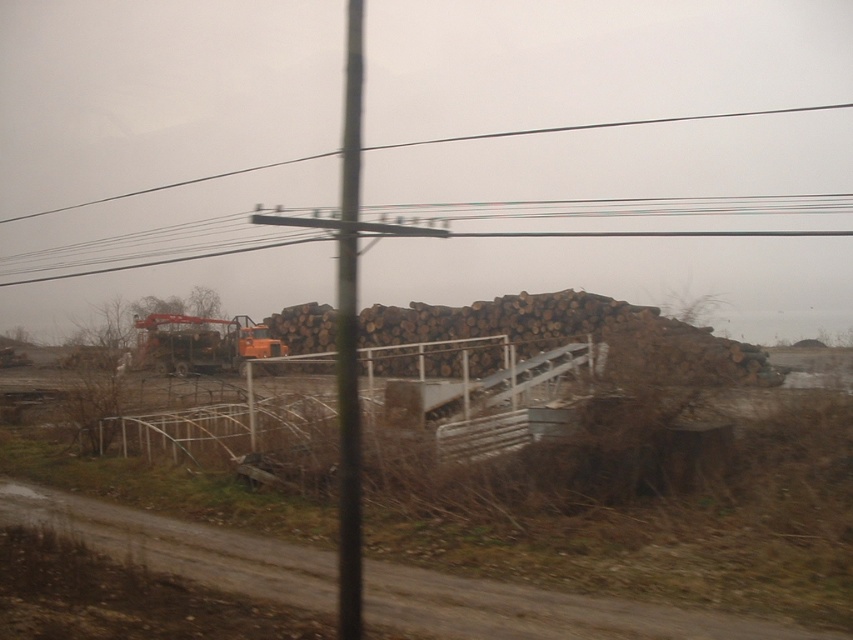
Looking at this image, measure the distance between metallic wire at upper center and camera.

metallic wire at upper center is 47.05 meters from camera.

Does metallic wire at upper center have a greater width compared to orange metallic excavator at center?

Indeed, metallic wire at upper center has a greater width compared to orange metallic excavator at center.

In order to click on metallic wire at upper center in this screenshot , I will do `click(608, 125)`.

This screenshot has height=640, width=853. What are the coordinates of `metallic pole at center` in the screenshot? It's located at (349, 339).

Based on the photo, does metallic pole at center come behind orange metallic excavator at center?

No.

Measure the distance between point (345,419) and camera.

Point (345,419) and camera are 5.41 meters apart.

At what (x,y) coordinates should I click in order to perform the action: click on metallic pole at center. Please return your answer as a coordinate pair (x, y). This screenshot has height=640, width=853. Looking at the image, I should click on (349, 339).

In the scene shown: Does metallic pole at center have a larger size compared to metallic wire at upper center?

Correct, metallic pole at center is larger in size than metallic wire at upper center.

Between metallic pole at center and metallic wire at upper center, which one has more height?

metallic pole at center is taller.

What do you see at coordinates (349, 339) in the screenshot? I see `metallic pole at center` at bounding box center [349, 339].

Identify the location of metallic pole at center. This screenshot has width=853, height=640. click(x=349, y=339).